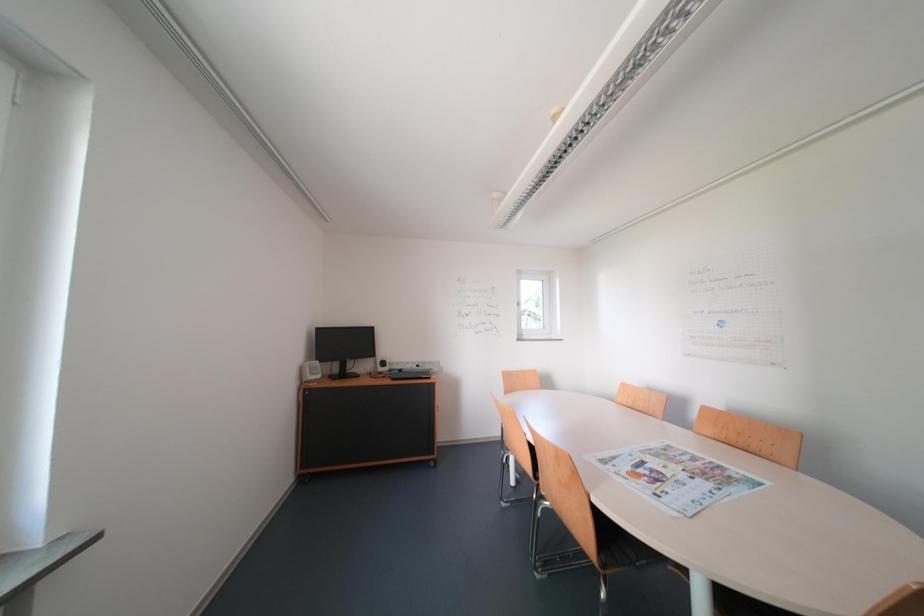
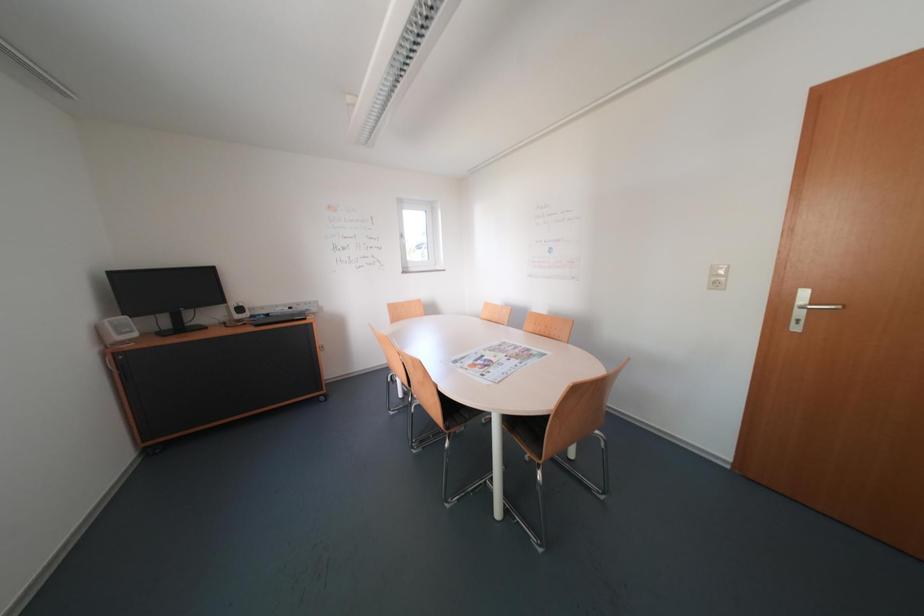
In a continuous first-person perspective shot, in which direction is the camera moving?

The cameraman walked toward right, backward.